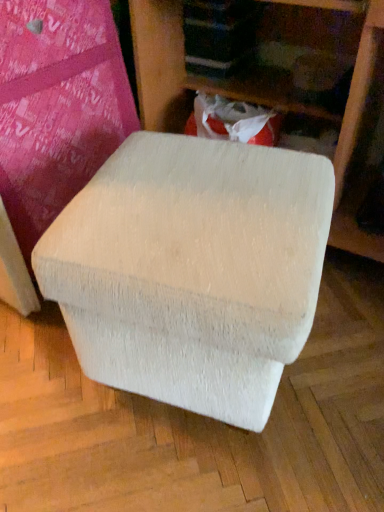
What do you see at coordinates (192, 270) in the screenshot? This screenshot has height=512, width=384. I see `white textured bean bag at center` at bounding box center [192, 270].

Find the location of a particular element. The width and height of the screenshot is (384, 512). white textured bean bag at center is located at coordinates (192, 270).

Locate an element on the screen. This screenshot has height=512, width=384. white fabric ottoman at center is located at coordinates (284, 85).

What is the approximate width of white fabric ottoman at center?

white fabric ottoman at center is 21.05 inches in width.

Describe the element at coordinates (284, 85) in the screenshot. I see `white fabric ottoman at center` at that location.

Measure the distance between point (x=302, y=4) and camera.

Point (x=302, y=4) is 1.18 meters away from camera.

In order to face white fabric ottoman at center, should I rotate leftwards or rightwards?

Turn right approximately 13.137 degrees to face it.

Locate an element on the screen. The height and width of the screenshot is (512, 384). white textured bean bag at center is located at coordinates (192, 270).

Is white textured bean bag at center at the left side of white fabric ottoman at center?

Correct, you'll find white textured bean bag at center to the left of white fabric ottoman at center.

Relative to white fabric ottoman at center, is white textured bean bag at center in front or behind?

white textured bean bag at center is positioned closer to the viewer than white fabric ottoman at center.

Which is less distant, [85,237] or [261,64]?

The point [85,237] is closer.

From the image's perspective, between white textured bean bag at center and white fabric ottoman at center, who is located below?

white textured bean bag at center.

In the scene shown: From a real-world perspective, does white textured bean bag at center stand above white fabric ottoman at center?

No, from a real-world perspective, white textured bean bag at center is not above white fabric ottoman at center.

In terms of width, does white textured bean bag at center look wider or thinner when compared to white fabric ottoman at center?

Clearly, white textured bean bag at center has less width compared to white fabric ottoman at center.

Does white textured bean bag at center have a lesser height compared to white fabric ottoman at center?

Correct, white textured bean bag at center is not as tall as white fabric ottoman at center.

Looking at the image, does white textured bean bag at center seem bigger or smaller compared to white fabric ottoman at center?

Clearly, white textured bean bag at center is smaller in size than white fabric ottoman at center.

Would you say white fabric ottoman at center is part of white textured bean bag at center's contents?

No.

In the scene shown: Is white textured bean bag at center positioned far away from white fabric ottoman at center?

No, there isn't a large distance between white textured bean bag at center and white fabric ottoman at center.

Is white textured bean bag at center oriented away from white fabric ottoman at center?

Yes, white textured bean bag at center's orientation is away from white fabric ottoman at center.

Locate an element on the screen. The height and width of the screenshot is (512, 384). furniture on the right of the white textured bean bag at center is located at coordinates (284, 85).

In the image, is white fabric ottoman at center on the left side or the right side of white textured bean bag at center?

white fabric ottoman at center is positioned on white textured bean bag at center's right side.

Is the depth of white fabric ottoman at center less than that of white textured bean bag at center?

No, the depth of white fabric ottoman at center is greater than that of white textured bean bag at center.

Does point (351, 228) lie in front of point (89, 214)?

No, it is not.

From the image's perspective, which one is positioned lower, white fabric ottoman at center or white textured bean bag at center?

white textured bean bag at center.

From a real-world perspective, is white fabric ottoman at center positioned above or below white textured bean bag at center?

white fabric ottoman at center is above white textured bean bag at center.

Considering the relative sizes of white fabric ottoman at center and white textured bean bag at center in the image provided, is white fabric ottoman at center wider than white textured bean bag at center?

Correct, the width of white fabric ottoman at center exceeds that of white textured bean bag at center.

Which of these two, white fabric ottoman at center or white textured bean bag at center, stands shorter?

white textured bean bag at center is shorter.

Does white fabric ottoman at center have a smaller size compared to white textured bean bag at center?

Actually, white fabric ottoman at center might be larger than white textured bean bag at center.

Is white fabric ottoman at center not inside white textured bean bag at center?

Yes, white fabric ottoman at center is not within white textured bean bag at center.

Would you consider white fabric ottoman at center to be distant from white textured bean bag at center?

That's not correct — white fabric ottoman at center is a little close to white textured bean bag at center.

Is white fabric ottoman at center looking in the opposite direction of white textured bean bag at center?

No, white fabric ottoman at center is not facing the opposite direction of white textured bean bag at center.

Find the location of a particular element. The height and width of the screenshot is (512, 384). furniture behind the white textured bean bag at center is located at coordinates (284, 85).

You are a GUI agent. You are given a task and a screenshot of the screen. Output one action in this format:
    pyautogui.click(x=<x>, y=<y>)
    Task: Click on the bean bag chair on the left of white fabric ottoman at center
    
    Given the screenshot: What is the action you would take?
    [192, 270]

In the image, there is a white fabric ottoman at center. Where is `bean bag chair below it (from the image's perspective)`? bean bag chair below it (from the image's perspective) is located at coordinates (192, 270).